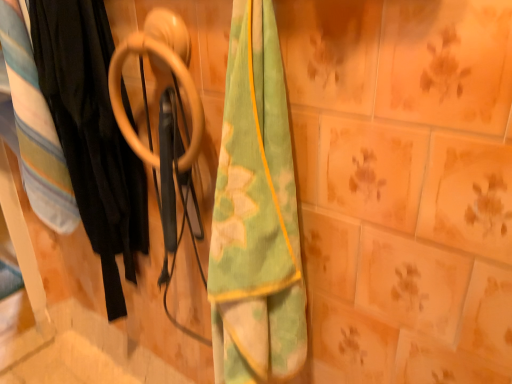
Question: Can you confirm if soft cotton blanket at left is smaller than green/yellow fabric towel at center?

Choices:
 (A) yes
 (B) no

Answer: (B)

Question: Are soft cotton blanket at left and green/yellow fabric towel at center far apart?

Choices:
 (A) yes
 (B) no

Answer: (B)

Question: Does soft cotton blanket at left appear on the right side of green/yellow fabric towel at center?

Choices:
 (A) no
 (B) yes

Answer: (A)

Question: Does soft cotton blanket at left appear on the left side of green/yellow fabric towel at center?

Choices:
 (A) no
 (B) yes

Answer: (B)

Question: Can you confirm if soft cotton blanket at left is wider than green/yellow fabric towel at center?

Choices:
 (A) no
 (B) yes

Answer: (B)

Question: Can you see soft cotton blanket at left touching green/yellow fabric towel at center?

Choices:
 (A) yes
 (B) no

Answer: (B)

Question: Can you confirm if green/yellow fabric towel at center is bigger than black fabric at left?

Choices:
 (A) yes
 (B) no

Answer: (B)

Question: Is green/yellow fabric towel at center oriented towards black fabric at left?

Choices:
 (A) no
 (B) yes

Answer: (A)

Question: From a real-world perspective, does green/yellow fabric towel at center stand above black fabric at left?

Choices:
 (A) yes
 (B) no

Answer: (B)

Question: Is green/yellow fabric towel at center turned away from black fabric at left?

Choices:
 (A) no
 (B) yes

Answer: (A)

Question: Is green/yellow fabric towel at center directly adjacent to black fabric at left?

Choices:
 (A) yes
 (B) no

Answer: (B)

Question: Is green/yellow fabric towel at center in front of black fabric at left?

Choices:
 (A) no
 (B) yes

Answer: (B)

Question: Is wooden ring at center a part of soft cotton blanket at left?

Choices:
 (A) yes
 (B) no

Answer: (B)